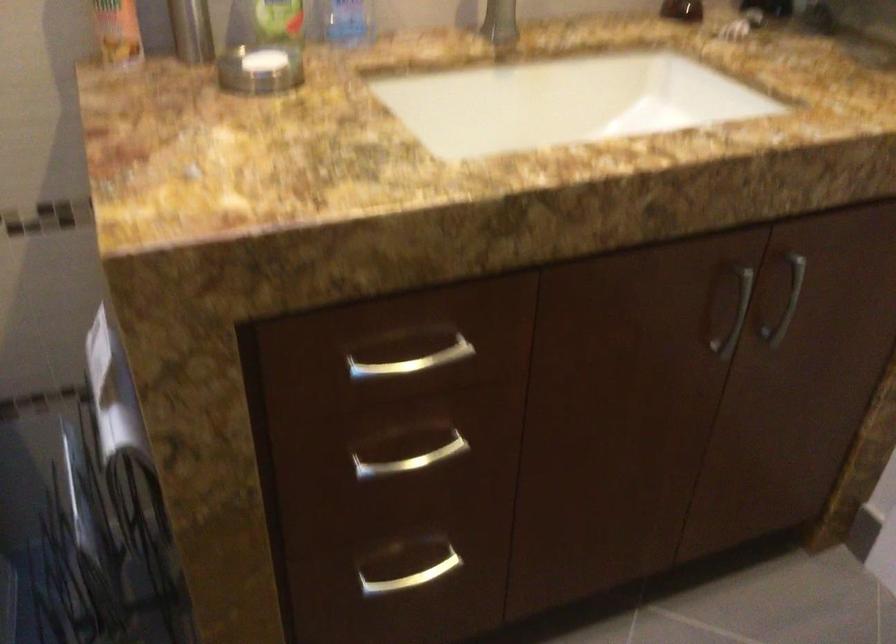
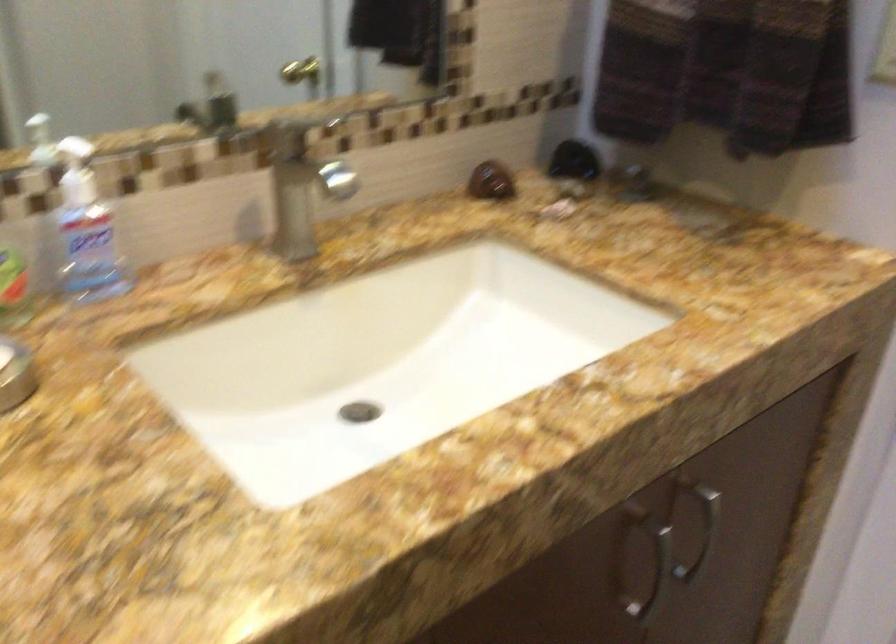
Locate, in the second image, the point that corresponds to (x=788, y=308) in the first image.

(702, 533)